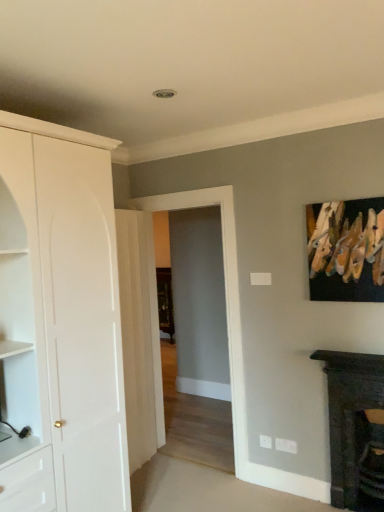
Question: Should I look upward or downward to see wooden clothespins at upper right?

Choices:
 (A) up
 (B) down

Answer: (B)

Question: Does transparent glass door at center contain dark wood fireplace at lower right?

Choices:
 (A) no
 (B) yes

Answer: (A)

Question: Is the surface of transparent glass door at center in direct contact with dark wood fireplace at lower right?

Choices:
 (A) yes
 (B) no

Answer: (B)

Question: Does transparent glass door at center have a greater height compared to dark wood fireplace at lower right?

Choices:
 (A) yes
 (B) no

Answer: (A)

Question: From the image's perspective, does transparent glass door at center appear higher than dark wood fireplace at lower right?

Choices:
 (A) yes
 (B) no

Answer: (A)

Question: Is transparent glass door at center thinner than dark wood fireplace at lower right?

Choices:
 (A) yes
 (B) no

Answer: (A)

Question: Is transparent glass door at center further to the viewer compared to dark wood fireplace at lower right?

Choices:
 (A) yes
 (B) no

Answer: (A)

Question: From a real-world perspective, is white glossy door at center on top of white matte cabinet at left?

Choices:
 (A) no
 (B) yes

Answer: (A)

Question: Considering the relative positions of white glossy door at center and white matte cabinet at left in the image provided, is white glossy door at center in front of white matte cabinet at left?

Choices:
 (A) no
 (B) yes

Answer: (A)

Question: From the image's perspective, would you say white glossy door at center is positioned over white matte cabinet at left?

Choices:
 (A) no
 (B) yes

Answer: (A)

Question: From the image's perspective, is white glossy door at center under white matte cabinet at left?

Choices:
 (A) no
 (B) yes

Answer: (B)

Question: Is white glossy door at center positioned far away from white matte cabinet at left?

Choices:
 (A) yes
 (B) no

Answer: (B)

Question: Considering the relative sizes of white glossy door at center and white matte cabinet at left in the image provided, is white glossy door at center bigger than white matte cabinet at left?

Choices:
 (A) no
 (B) yes

Answer: (A)

Question: Considering the relative sizes of transparent glass door at center and wooden clothespins at upper right in the image provided, is transparent glass door at center shorter than wooden clothespins at upper right?

Choices:
 (A) no
 (B) yes

Answer: (A)